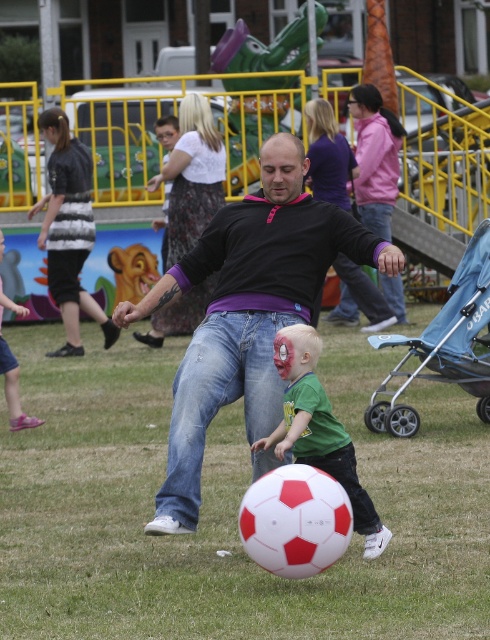
Between point (376, 268) and point (64, 228), which one is positioned in front?

Point (376, 268)

Between matte black shirt at center and striped fabric shirt at left, which one appears on the left side from the viewer's perspective?

striped fabric shirt at left

Where is `matte black shirt at center`? This screenshot has height=640, width=490. matte black shirt at center is located at coordinates [x=247, y=310].

At what (x,y) coordinates should I click in order to perform the action: click on matte black shirt at center. Please return your answer as a coordinate pair (x, y). Looking at the image, I should click on (247, 310).

Does matte black shirt at center have a lesser height compared to pink fabric pants at lower left?

No, matte black shirt at center is not shorter than pink fabric pants at lower left.

What do you see at coordinates (247, 310) in the screenshot?
I see `matte black shirt at center` at bounding box center [247, 310].

Is point (187, 448) in front of point (1, 372)?

Yes, it is.

The image size is (490, 640). I want to click on matte black shirt at center, so click(x=247, y=310).

Does blue fabric stroller at center-right have a lesser width compared to green matte shirt at center?

In fact, blue fabric stroller at center-right might be wider than green matte shirt at center.

Who is shorter, blue fabric stroller at center-right or green matte shirt at center?

green matte shirt at center is shorter.

Who is more forward, (444,374) or (305,424)?

Point (305,424)

I want to click on blue fabric stroller at center-right, so click(x=443, y=344).